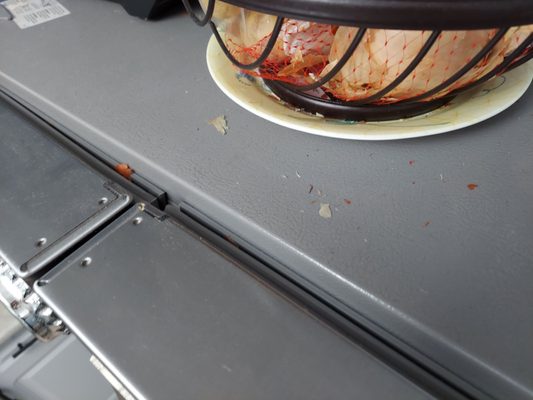
Find the location of a particular element. This screenshot has width=533, height=400. knob is located at coordinates (24, 296).